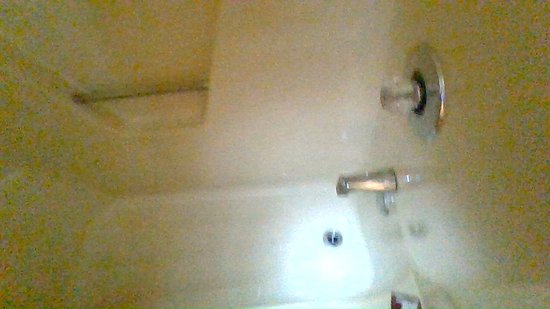
Locate an element on the screen. back lip of bath tub is located at coordinates (258, 188).